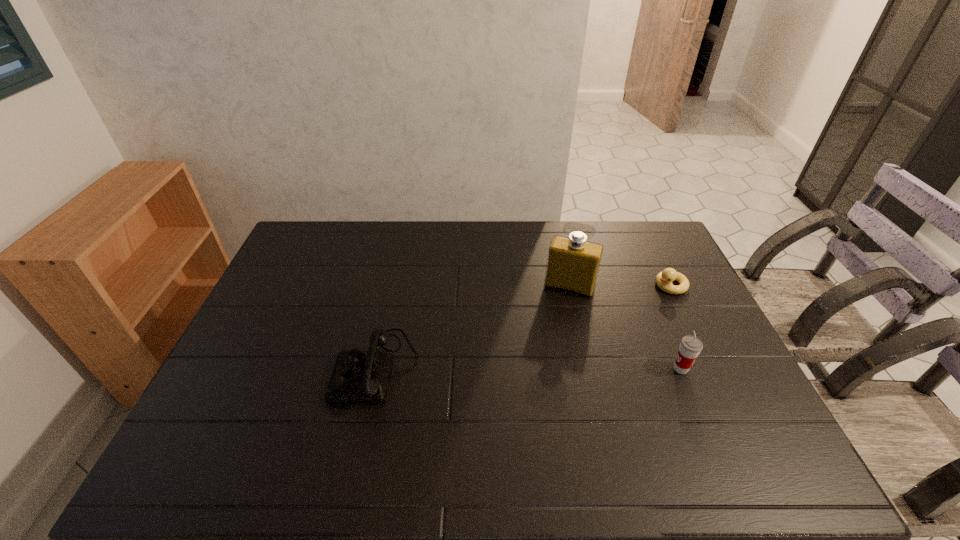
The image size is (960, 540). Find the location of `duckling that is at the right edge`. duckling that is at the right edge is located at coordinates (664, 279).

You are a GUI agent. You are given a task and a screenshot of the screen. Output one action in this format:
    pyautogui.click(x=<x>, y=<y>)
    Task: Click on the free space at the far edge
    This screenshot has height=540, width=960.
    Given the screenshot: What is the action you would take?
    pyautogui.click(x=602, y=221)

The image size is (960, 540). Identify the location of vacant area at the left edge of the desktop. (280, 294).

This screenshot has width=960, height=540. Identify the location of free point at the right edge. (682, 323).

The height and width of the screenshot is (540, 960). What are the coordinates of `vacant area at the far left corner` in the screenshot? It's located at (288, 248).

Image resolution: width=960 pixels, height=540 pixels. In order to click on vacant space at the far right corner of the desktop in this screenshot , I will do coord(642,239).

Locate an element on the screen. This screenshot has width=960, height=540. vacant space at the near right corner of the desktop is located at coordinates (754, 423).

Where is `vacant area that lies between the shortest object and the third object from right to left`? vacant area that lies between the shortest object and the third object from right to left is located at coordinates (620, 286).

Find the location of a particular element. This screenshot has width=960, height=540. free space between the cup and the shortest object is located at coordinates (676, 327).

Image resolution: width=960 pixels, height=540 pixels. I want to click on free spot between the leftmost object and the cup, so click(529, 368).